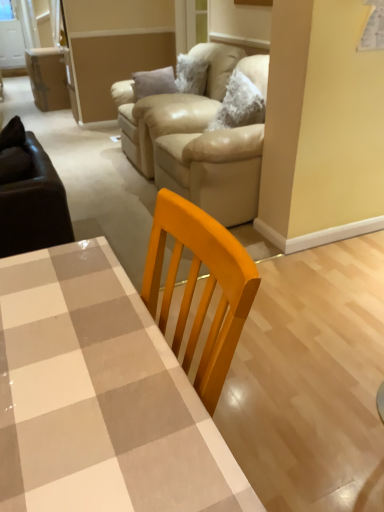
Question: Considering the relative sizes of beige leather couch at upper center and checkered glossy table at center in the image provided, is beige leather couch at upper center wider than checkered glossy table at center?

Choices:
 (A) no
 (B) yes

Answer: (B)

Question: Can you confirm if beige leather couch at upper center is shorter than checkered glossy table at center?

Choices:
 (A) yes
 (B) no

Answer: (B)

Question: Is beige leather couch at upper center placed right next to checkered glossy table at center?

Choices:
 (A) yes
 (B) no

Answer: (B)

Question: Considering the relative positions of beige leather couch at upper center and checkered glossy table at center in the image provided, is beige leather couch at upper center behind checkered glossy table at center?

Choices:
 (A) no
 (B) yes

Answer: (B)

Question: Can you confirm if beige leather couch at upper center is positioned to the right of checkered glossy table at center?

Choices:
 (A) yes
 (B) no

Answer: (A)

Question: Looking at the image, does beige leather armchair at upper center seem bigger or smaller compared to beige leather couch at upper center?

Choices:
 (A) big
 (B) small

Answer: (B)

Question: In the image, is beige leather armchair at upper center positioned in front of or behind beige leather couch at upper center?

Choices:
 (A) behind
 (B) front

Answer: (A)

Question: In the image, is beige leather armchair at upper center on the left side or the right side of beige leather couch at upper center?

Choices:
 (A) left
 (B) right

Answer: (A)

Question: Is point (218, 108) closer or farther from the camera than point (246, 140)?

Choices:
 (A) farther
 (B) closer

Answer: (A)

Question: Would you say checkered glossy table at center is to the left or to the right of beige leather armchair at upper center in the picture?

Choices:
 (A) right
 (B) left

Answer: (B)

Question: Is checkered glossy table at center spatially inside beige leather armchair at upper center, or outside of it?

Choices:
 (A) inside
 (B) outside

Answer: (B)

Question: Considering the positions of checkered glossy table at center and beige leather armchair at upper center in the image, is checkered glossy table at center bigger or smaller than beige leather armchair at upper center?

Choices:
 (A) small
 (B) big

Answer: (A)

Question: From the image's perspective, is checkered glossy table at center above or below beige leather armchair at upper center?

Choices:
 (A) above
 (B) below

Answer: (B)

Question: From the image's perspective, is beige leather couch at upper center located above or below beige leather armchair at upper center?

Choices:
 (A) above
 (B) below

Answer: (B)

Question: Relative to beige leather armchair at upper center, is beige leather couch at upper center in front or behind?

Choices:
 (A) front
 (B) behind

Answer: (A)